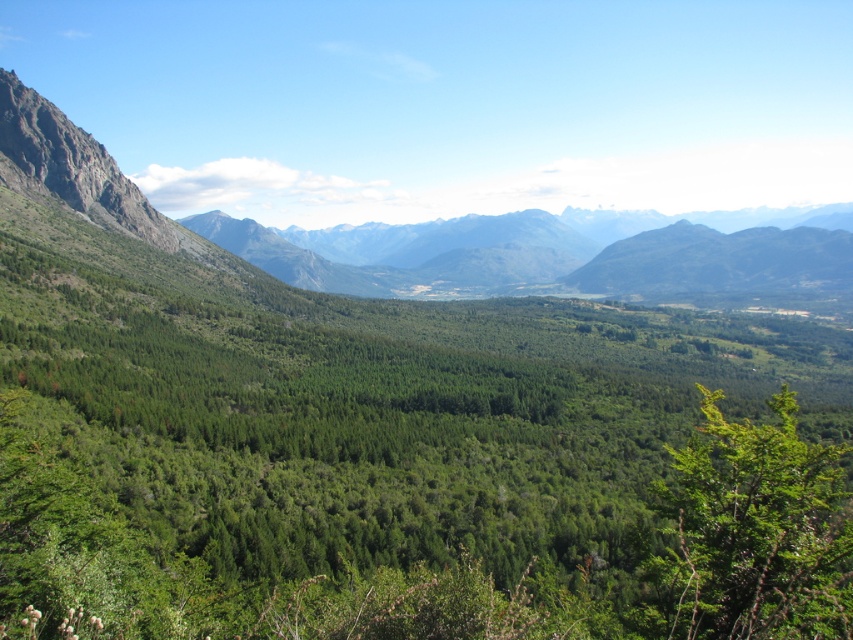
Question: Does green forested mountain at left have a greater width compared to green leafy tree at lower right?

Choices:
 (A) no
 (B) yes

Answer: (B)

Question: Is green forested mountain at left wider than green leafy tree at lower right?

Choices:
 (A) no
 (B) yes

Answer: (B)

Question: Which point appears closest to the camera in this image?

Choices:
 (A) (737, 572)
 (B) (683, 237)

Answer: (A)

Question: Which point appears closest to the camera in this image?

Choices:
 (A) (669, 580)
 (B) (595, 259)

Answer: (A)

Question: Is green forested mountain at left further to camera compared to green leafy tree at lower right?

Choices:
 (A) yes
 (B) no

Answer: (A)

Question: Which of these objects is positioned farthest from the green leafy tree at lower right?

Choices:
 (A) green forested mountain at left
 (B) green forested mountain range at center

Answer: (B)